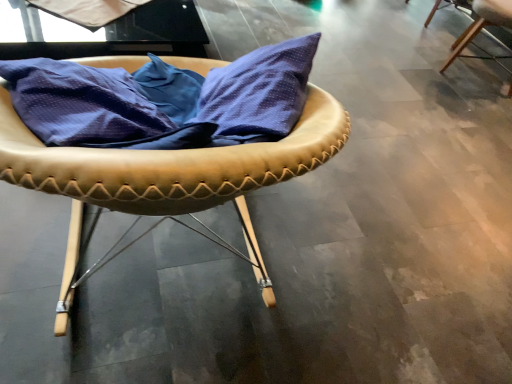
Question: In terms of width, does white matte fabric at upper left look wider or thinner when compared to leather-like tan chair at center, positioned as the 1th chair in front-to-back order?

Choices:
 (A) wide
 (B) thin

Answer: (A)

Question: Looking at the image, does white matte fabric at upper left seem bigger or smaller compared to leather-like tan chair at center, which ranks as the first chair in left-to-right order?

Choices:
 (A) big
 (B) small

Answer: (B)

Question: Which object is the closest to the white matte fabric at upper left?

Choices:
 (A) light brown leather chair at upper right, which ranks as the first chair in back-to-front order
 (B) leather-like tan chair at center, placed as the 2th chair when sorted from right to left

Answer: (B)

Question: Which object is positioned closest to the leather-like tan chair at center, positioned as the 1th chair in front-to-back order?

Choices:
 (A) light brown leather chair at upper right, placed as the 2th chair when sorted from bottom to top
 (B) white matte fabric at upper left

Answer: (B)